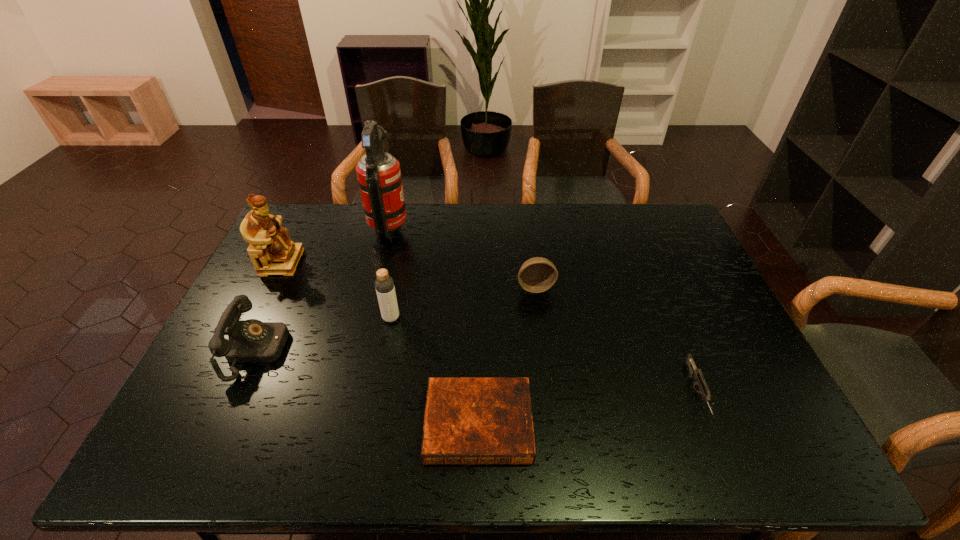
At what (x,y) coordinates should I click in order to perform the action: click on blank area located 0.210m on the front label side of the farthest object. Please return your answer as a coordinate pair (x, y). The height and width of the screenshot is (540, 960). Looking at the image, I should click on (468, 228).

What are the coordinates of `vacant space located 0.060m on the front-facing side of the figurine` in the screenshot? It's located at (318, 262).

The width and height of the screenshot is (960, 540). In order to click on free location located 0.150m on the back of the fifth shortest object in this screenshot , I will do `click(399, 276)`.

Where is `free space located 0.390m on the dial of the telephone`? The height and width of the screenshot is (540, 960). free space located 0.390m on the dial of the telephone is located at coordinates (428, 350).

Locate an element on the screen. This screenshot has width=960, height=540. free space located on the left of the bowl is located at coordinates (407, 287).

Where is `vacant space located aimed along the barrel of the sixth tallest object`? This screenshot has width=960, height=540. vacant space located aimed along the barrel of the sixth tallest object is located at coordinates (726, 463).

You are a GUI agent. You are given a task and a screenshot of the screen. Output one action in this format:
    pyautogui.click(x=<x>, y=<y>)
    Task: Click on the object located in the far edge section of the desktop
    The height and width of the screenshot is (540, 960).
    Given the screenshot: What is the action you would take?
    pyautogui.click(x=379, y=176)

Locate an element on the screen. This screenshot has height=540, width=960. object that is at the near edge is located at coordinates (467, 420).

This screenshot has width=960, height=540. Find the location of `figurine at the left edge`. figurine at the left edge is located at coordinates (269, 241).

I want to click on telephone situated at the left edge, so click(249, 341).